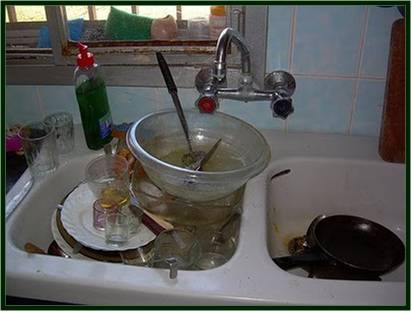
Where is `sponge`? The image size is (412, 312). sponge is located at coordinates (125, 26).